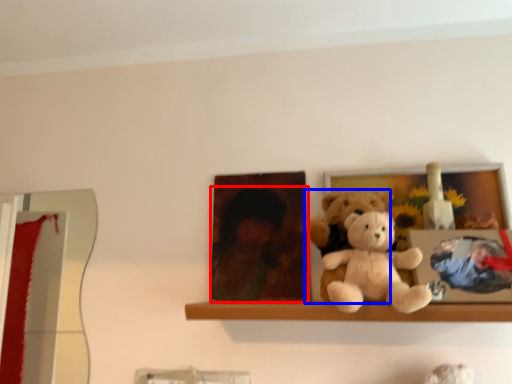
Question: Among these objects, which one is farthest to the camera, person (highlighted by a red box) or teddy bear (highlighted by a blue box)?

Choices:
 (A) person
 (B) teddy bear

Answer: (A)